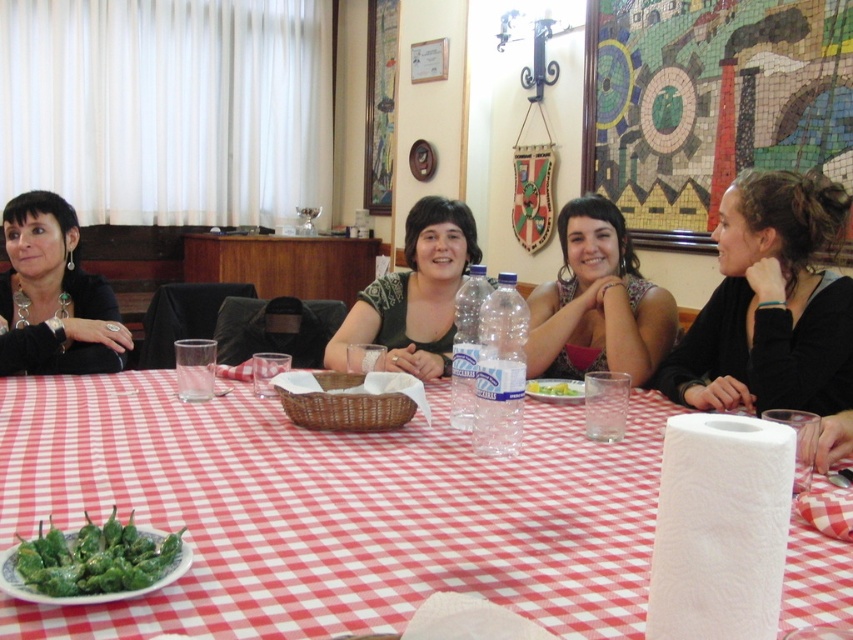
Question: Can you confirm if red checkered tablecloth at center is smaller than black matte hair at upper right?

Choices:
 (A) yes
 (B) no

Answer: (B)

Question: Which object is farther from the camera taking this photo?

Choices:
 (A) red checkered tablecloth at center
 (B) black matte hair at upper right
 (C) matte green dress at center

Answer: (C)

Question: Is black matte hair at upper right closer to camera compared to green glossy peppers at center?

Choices:
 (A) yes
 (B) no

Answer: (B)

Question: Which of these objects is positioned closest to the black matte hair at upper right?

Choices:
 (A) green leafy salad at center
 (B) green glossy peppers at center
 (C) red checkered tablecloth at center
 (D) matte green dress at center

Answer: (D)

Question: Is black matte hair at upper right to the left of matte green dress at center from the viewer's perspective?

Choices:
 (A) yes
 (B) no

Answer: (B)

Question: Which object is the closest to the green textured shirt at center?

Choices:
 (A) black matte hair at upper right
 (B) matte black jacket at left
 (C) red checkered tablecloth at center

Answer: (C)